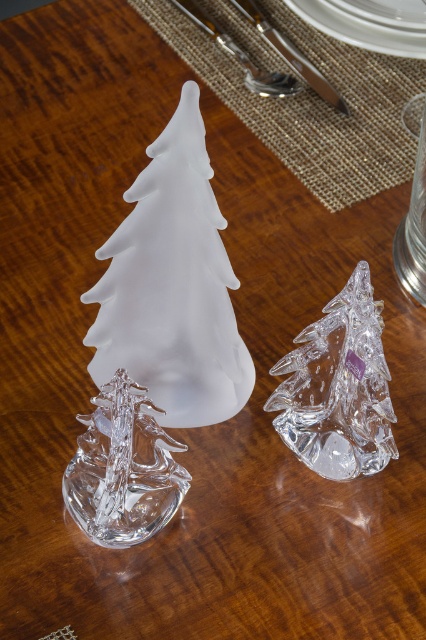
Can you confirm if satin silver knife at upper center is shorter than polished silver knife at upper center?

Yes.

Does satin silver knife at upper center appear under polished silver knife at upper center?

Actually, satin silver knife at upper center is above polished silver knife at upper center.

Describe the element at coordinates (241, 56) in the screenshot. This screenshot has height=640, width=426. I see `satin silver knife at upper center` at that location.

Where is `satin silver knife at upper center`? The height and width of the screenshot is (640, 426). satin silver knife at upper center is located at coordinates (241, 56).

Does transparent glass tree at center have a lesser height compared to polished silver knife at upper center?

In fact, transparent glass tree at center may be taller than polished silver knife at upper center.

Is transparent glass tree at center bigger than polished silver knife at upper center?

Incorrect, transparent glass tree at center is not larger than polished silver knife at upper center.

I want to click on transparent glass tree at center, so click(x=339, y=387).

Describe the element at coordinates (172, 285) in the screenshot. I see `frosted glass tree at center` at that location.

Between frosted glass tree at center and satin silver knife at upper center, which one has more height?

Standing taller between the two is frosted glass tree at center.

Where is `frosted glass tree at center`? This screenshot has height=640, width=426. frosted glass tree at center is located at coordinates point(172,285).

Image resolution: width=426 pixels, height=640 pixels. In order to click on frosted glass tree at center in this screenshot , I will do `click(172, 285)`.